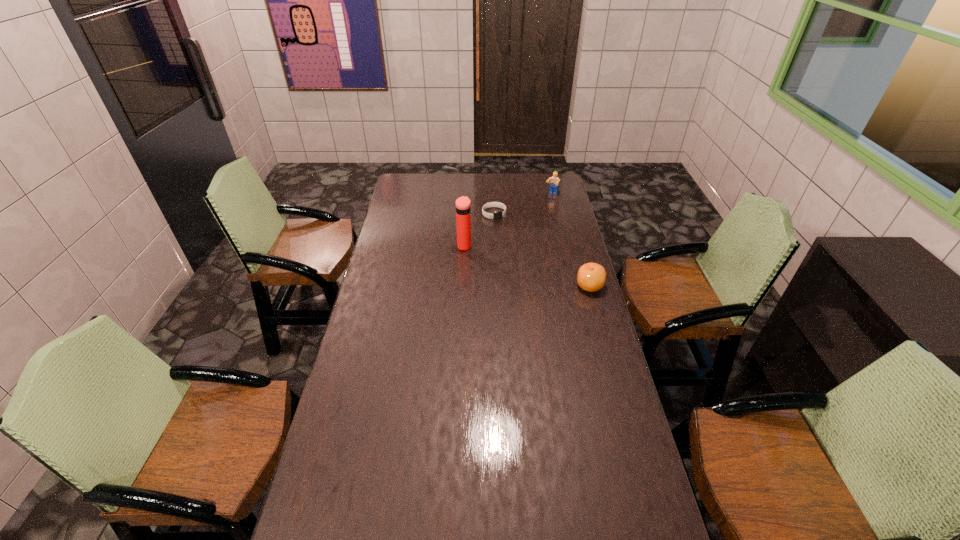
You are a GUI agent. You are given a task and a screenshot of the screen. Output one action in this format:
    pyautogui.click(x=<x>, y=<y>)
    Task: Click on the third farthest object
    
    Given the screenshot: What is the action you would take?
    pyautogui.click(x=463, y=206)

At what (x,y) coordinates should I click in order to perform the action: click on thermos bottle. Please return your answer as a coordinate pair (x, y). Looking at the image, I should click on (463, 206).

Image resolution: width=960 pixels, height=540 pixels. In order to click on clementine in this screenshot , I will do `click(591, 277)`.

You are a GUI agent. You are given a task and a screenshot of the screen. Output one action in this format:
    pyautogui.click(x=<x>, y=<y>)
    Task: Click on the second shortest object
    The height and width of the screenshot is (540, 960).
    Given the screenshot: What is the action you would take?
    pyautogui.click(x=591, y=277)

At what (x,y) coordinates should I click in order to perform the action: click on the third object from right to left. Please return your answer as a coordinate pair (x, y). Image resolution: width=960 pixels, height=540 pixels. Looking at the image, I should click on (497, 215).

The image size is (960, 540). I want to click on the third nearest object, so click(497, 215).

I want to click on the second tallest object, so click(554, 182).

Locate an element on the screen. This screenshot has width=960, height=540. Lego is located at coordinates (554, 182).

At what (x,y) coordinates should I click in order to perform the action: click on vacant space located 0.310m on the right of the thermos bottle. Please return your answer as a coordinate pair (x, y). Looking at the image, I should click on (540, 246).

Where is `vacant space situated 0.120m on the front of the nearest object`? vacant space situated 0.120m on the front of the nearest object is located at coordinates (599, 319).